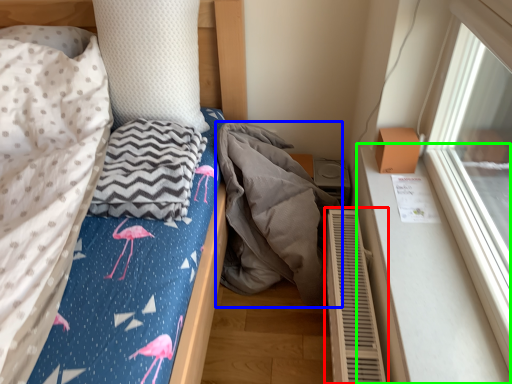
Question: Which object is positioned farthest from air conditioner (highlighted by a red box)? Select from material (highlighted by a blue box) and window sill (highlighted by a green box).

Choices:
 (A) material
 (B) window sill

Answer: (A)